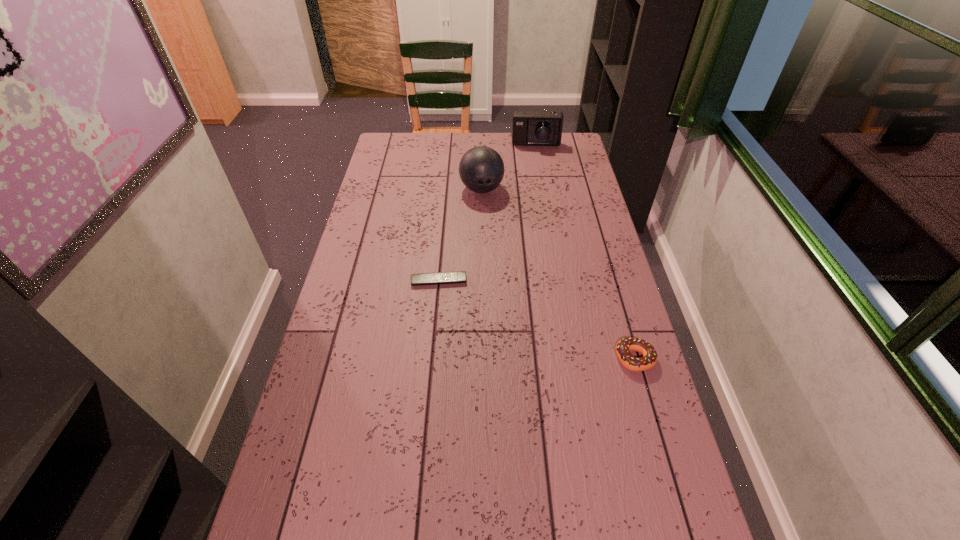
What are the coordinates of `blank space located 0.370m on the front-facing side of the camera` in the screenshot? It's located at (533, 201).

I want to click on free point located 0.290m on the front-facing side of the camera, so click(533, 189).

Find the location of a particular element. The width and height of the screenshot is (960, 540). vacant space located 0.280m on the front-facing side of the camera is located at coordinates (533, 187).

In order to click on vacant space positioned on the grip area of the bowling ball in this screenshot , I will do tap(493, 239).

This screenshot has width=960, height=540. I want to click on free space located on the grip area of the bowling ball, so click(x=490, y=221).

At what (x,y) coordinates should I click in order to perform the action: click on vacant space located on the grip area of the bowling ball. Please return your answer as a coordinate pair (x, y). The image size is (960, 540). Looking at the image, I should click on (500, 268).

The image size is (960, 540). Find the location of `object located in the far edge section of the desktop`. object located in the far edge section of the desktop is located at coordinates (530, 128).

I want to click on doughnut located at the right edge, so click(x=625, y=345).

Find the location of a particular element. This screenshot has width=960, height=540. camera that is at the right edge is located at coordinates (530, 128).

Find the location of a particular element. This screenshot has width=960, height=540. object that is at the far right corner is located at coordinates (530, 128).